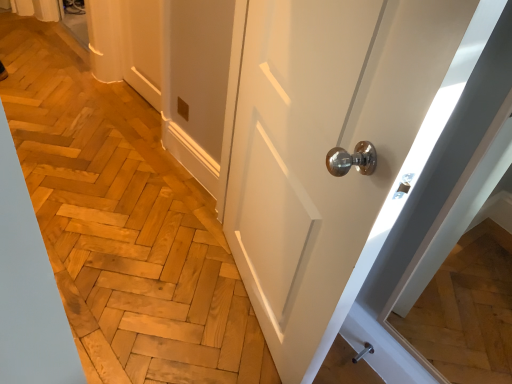
Question: Is point (275, 172) positioned closer to the camera than point (368, 349)?

Choices:
 (A) farther
 (B) closer

Answer: (B)

Question: Considering the positions of white glossy door at center and polished metallic door handle at lower right in the image, is white glossy door at center bigger or smaller than polished metallic door handle at lower right?

Choices:
 (A) small
 (B) big

Answer: (B)

Question: From the image's perspective, relative to polished metallic door handle at lower right, is white glossy door at center above or below?

Choices:
 (A) above
 (B) below

Answer: (A)

Question: From the image's perspective, is polished metallic door handle at lower right above or below white glossy door at center?

Choices:
 (A) below
 (B) above

Answer: (A)

Question: Visually, is polished metallic door handle at lower right positioned to the left or to the right of white glossy door at center?

Choices:
 (A) left
 (B) right

Answer: (B)

Question: Is polished metallic door handle at lower right in front of or behind white glossy door at center in the image?

Choices:
 (A) front
 (B) behind

Answer: (B)

Question: From a real-world perspective, is polished metallic door handle at lower right positioned above or below white glossy door at center?

Choices:
 (A) above
 (B) below

Answer: (B)